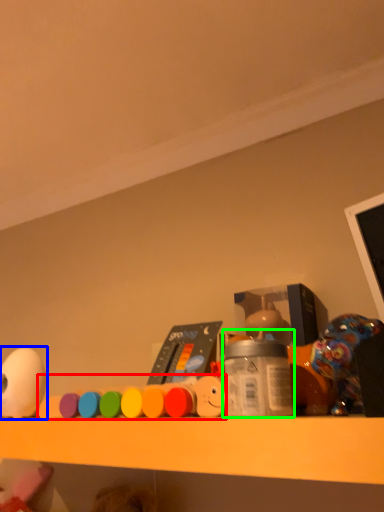
Question: Which object is positioned farthest from toy (highlighted by a red box)? Select from toy (highlighted by a blue box) and bottle (highlighted by a green box).

Choices:
 (A) toy
 (B) bottle

Answer: (A)